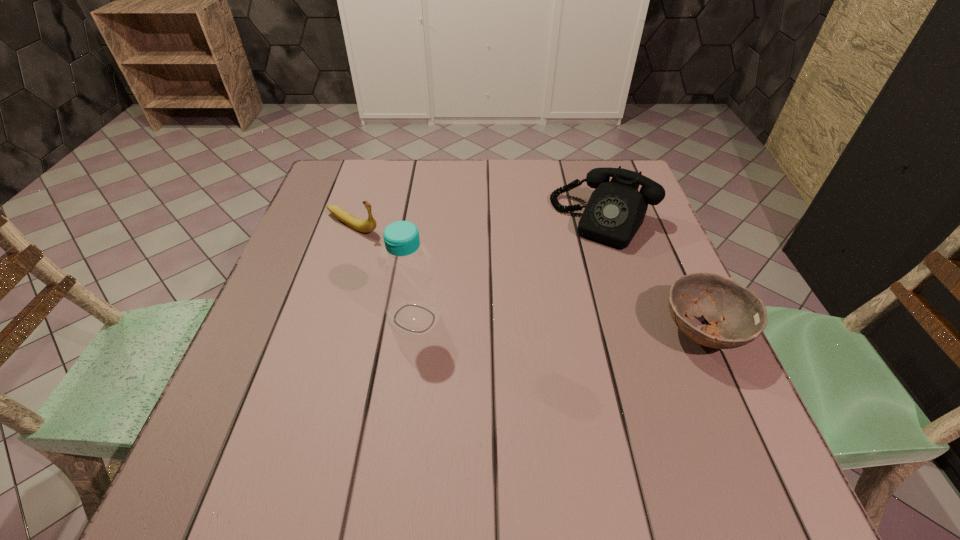
You are a GUI agent. You are given a task and a screenshot of the screen. Output one action in this format:
    pyautogui.click(x=<x>, y=<y>)
    Task: Click on the vacant space located at the stem of the second shortest object
    Image resolution: width=960 pixels, height=540 pixels.
    Given the screenshot: What is the action you would take?
    point(403,248)

You are a GUI agent. You are given a task and a screenshot of the screen. Output one action in this format:
    pyautogui.click(x=<x>, y=<y>)
    Task: Click on the free point located on the dial of the telephone
    This screenshot has height=540, width=960.
    Given the screenshot: What is the action you would take?
    click(x=567, y=281)

At what (x,y) coordinates should I click in order to perform the action: click on free spot located on the dial of the telephone. Please return your answer as a coordinate pair (x, y). This screenshot has width=960, height=540. Looking at the image, I should click on (544, 320).

Identify the location of vacant space positioned 0.070m on the dial of the telephone. (576, 265).

The image size is (960, 540). In order to click on object that is at the far edge in this screenshot , I will do `click(615, 211)`.

The image size is (960, 540). What are the coordinates of `object that is at the left edge` in the screenshot? It's located at (368, 225).

The image size is (960, 540). Identify the location of bowl situated at the right edge. (736, 316).

Identify the location of telephone at the right edge. The height and width of the screenshot is (540, 960). (615, 211).

The height and width of the screenshot is (540, 960). Identify the location of object present at the far right corner. (615, 211).

You are a GUI agent. You are given a task and a screenshot of the screen. Output one action in this format:
    pyautogui.click(x=<x>, y=<y>)
    Task: Click on the free space at the far edge
    The height and width of the screenshot is (540, 960).
    Given the screenshot: What is the action you would take?
    pyautogui.click(x=569, y=199)